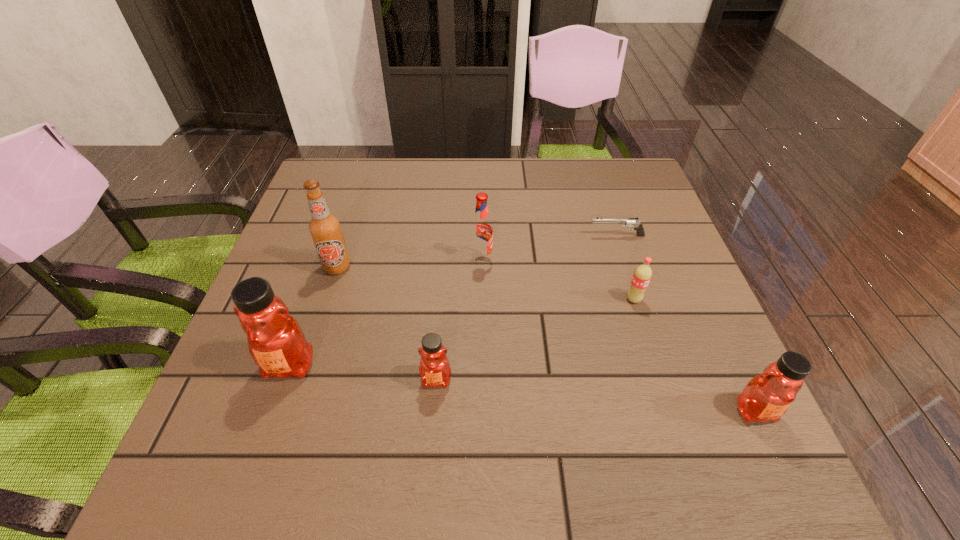
Locate an element on the screen. This screenshot has width=960, height=540. free space located 0.070m on the front label of the leftmost honey is located at coordinates (269, 423).

This screenshot has width=960, height=540. Find the location of `vacant space located on the right of the fourth nearest object`. vacant space located on the right of the fourth nearest object is located at coordinates (697, 299).

Where is `free spot located 0.190m on the left of the root beer`? The image size is (960, 540). free spot located 0.190m on the left of the root beer is located at coordinates (391, 260).

I want to click on vacant space located 0.060m on the front-facing side of the pistol, so (564, 235).

Identify the location of vacant space situated 0.290m on the front-facing side of the pistol. click(472, 235).

Where is `vacant region located 0.340m on the front-facing side of the pistol`? vacant region located 0.340m on the front-facing side of the pistol is located at coordinates coord(453,235).

Where is `vacant position located on the front label of the beer bottle`? vacant position located on the front label of the beer bottle is located at coordinates (316, 334).

I want to click on honey that is positioned at the left edge, so click(x=276, y=342).

This screenshot has width=960, height=540. I want to click on beer bottle at the left edge, so pyautogui.click(x=325, y=229).

Identify the location of honey located in the right edge section of the desktop. (767, 396).